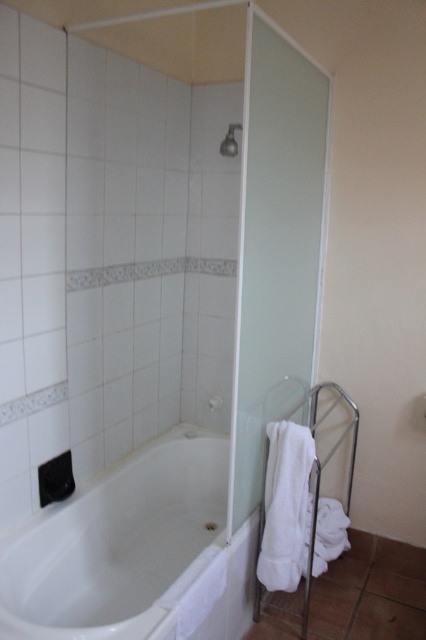
Question: Considering the relative positions of transparent frosted glass door at right and satin silver faucet at upper center in the image provided, where is transparent frosted glass door at right located with respect to satin silver faucet at upper center?

Choices:
 (A) above
 (B) below

Answer: (B)

Question: Which point is farther to the camera?

Choices:
 (A) satin silver faucet at upper center
 (B) transparent frosted glass door at right
 (C) white glossy bathtub at lower left

Answer: (A)

Question: Which point is closer to the camera?

Choices:
 (A) (232, 147)
 (B) (256, 202)
 (C) (135, 616)

Answer: (C)

Question: Is white glossy bathtub at lower left bigger than transparent frosted glass door at right?

Choices:
 (A) no
 (B) yes

Answer: (B)

Question: Considering the real-world distances, which object is closest to the transparent frosted glass door at right?

Choices:
 (A) satin silver faucet at upper center
 (B) white glossy bathtub at lower left

Answer: (A)

Question: Can you confirm if transparent frosted glass door at right is positioned above satin silver faucet at upper center?

Choices:
 (A) yes
 (B) no

Answer: (B)